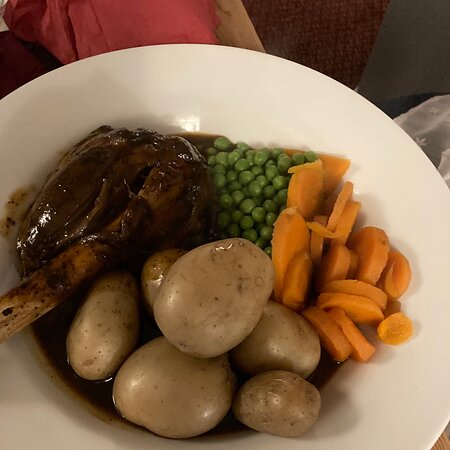
Locate an element on the screen. place mat is located at coordinates (326, 50).